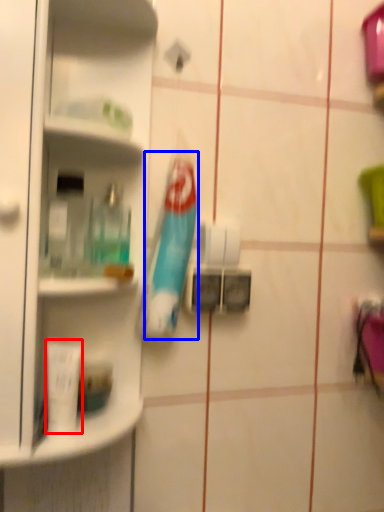
Question: Among these objects, which one is farthest to the camera, toiletry (highlighted by a red box) or toothbrush (highlighted by a blue box)?

Choices:
 (A) toiletry
 (B) toothbrush

Answer: (B)